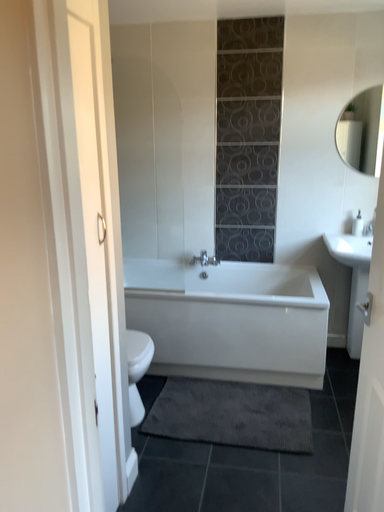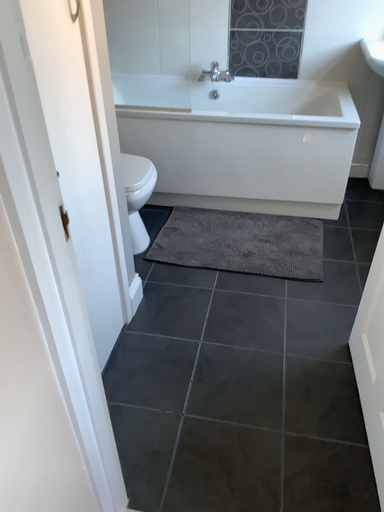
Question: Which way did the camera rotate in the video?

Choices:
 (A) rotated upward
 (B) rotated downward

Answer: (B)